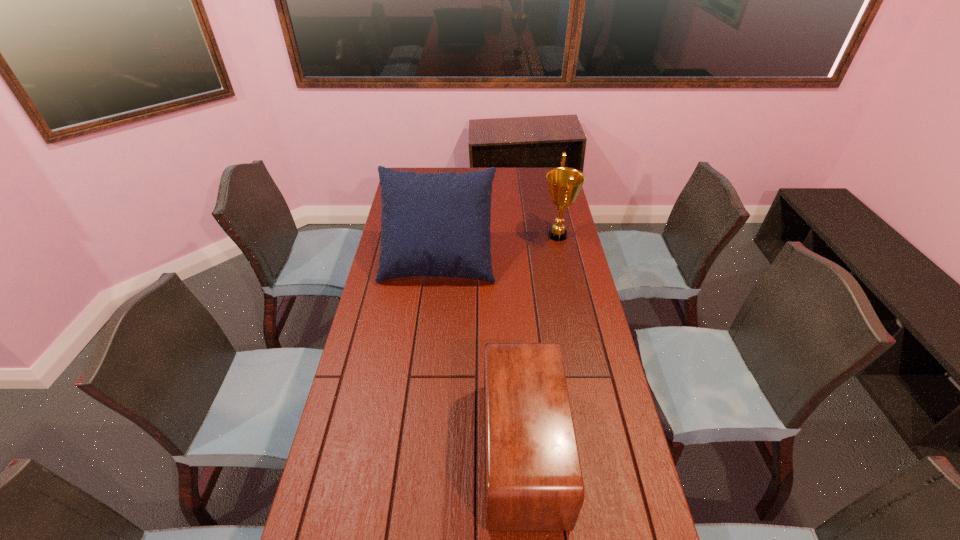
This screenshot has width=960, height=540. What are the coordinates of `empty space that is in between the radio receiver and the cushion` in the screenshot? It's located at (480, 355).

The width and height of the screenshot is (960, 540). I want to click on free space between the cushion and the shortest object, so click(x=480, y=355).

I want to click on object that stands as the second closest to the cushion, so click(x=533, y=479).

The width and height of the screenshot is (960, 540). Identify the location of the closest object to the cushion. pos(564,183).